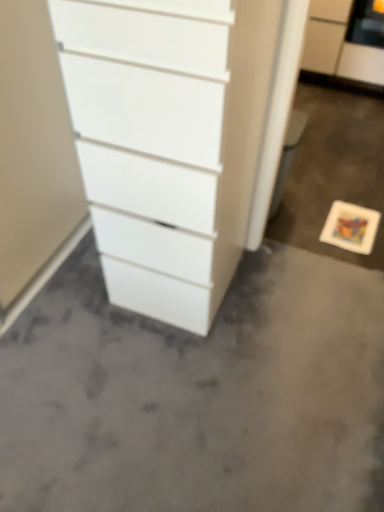
The image size is (384, 512). What are the coordinates of `vacant area situated to the left side of white glossy chest of drawers at center` in the screenshot? It's located at (69, 295).